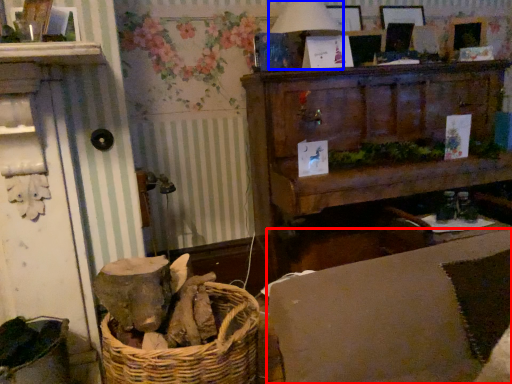
Question: Which of the following is the farthest to the observer, couch (highlighted by a red box) or table lamp (highlighted by a blue box)?

Choices:
 (A) couch
 (B) table lamp

Answer: (B)